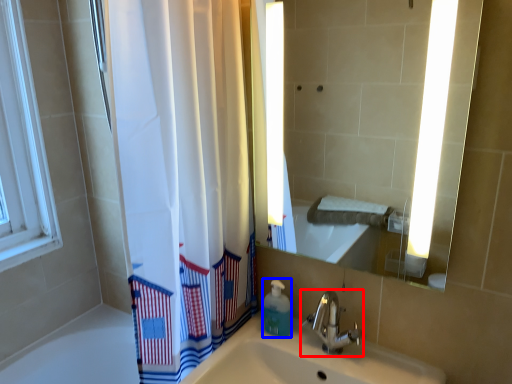
Question: Which point is further to the camera, tap (highlighted by a red box) or soap dispenser (highlighted by a blue box)?

Choices:
 (A) tap
 (B) soap dispenser

Answer: (B)